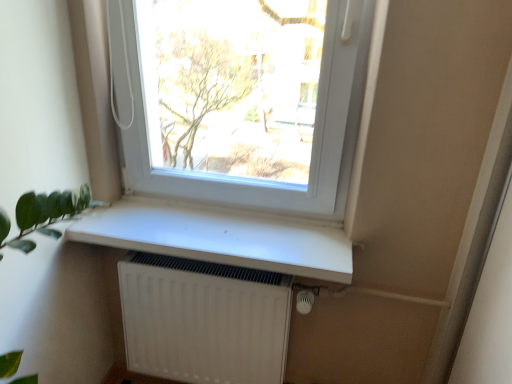
Question: Considering the relative sizes of white plastic window at upper center and white matte window sill at center in the image provided, is white plastic window at upper center bigger than white matte window sill at center?

Choices:
 (A) no
 (B) yes

Answer: (B)

Question: From the image's perspective, is white plastic window at upper center above white matte window sill at center?

Choices:
 (A) no
 (B) yes

Answer: (B)

Question: Can you confirm if white plastic window at upper center is positioned to the left of white matte window sill at center?

Choices:
 (A) no
 (B) yes

Answer: (A)

Question: Is white plastic window at upper center in contact with white matte window sill at center?

Choices:
 (A) no
 (B) yes

Answer: (A)

Question: Can you confirm if white plastic window at upper center is thinner than white matte window sill at center?

Choices:
 (A) no
 (B) yes

Answer: (B)

Question: From a real-world perspective, relative to white plastic window at upper center, is white matte window sill at center vertically above or below?

Choices:
 (A) above
 (B) below

Answer: (B)

Question: Is white matte window sill at center inside or outside of white plastic window at upper center?

Choices:
 (A) outside
 (B) inside

Answer: (A)

Question: Is point pyautogui.click(x=281, y=256) closer or farther from the camera than point pyautogui.click(x=170, y=0)?

Choices:
 (A) closer
 (B) farther

Answer: (A)

Question: In the image, is white matte window sill at center positioned in front of or behind white plastic window at upper center?

Choices:
 (A) behind
 (B) front

Answer: (A)

Question: Is point (130, 296) positioned closer to the camera than point (185, 231)?

Choices:
 (A) farther
 (B) closer

Answer: (A)

Question: In terms of height, does white matte radiator at lower center look taller or shorter compared to white matte window sill at center?

Choices:
 (A) short
 (B) tall

Answer: (B)

Question: Visually, is white matte radiator at lower center positioned to the left or to the right of white matte window sill at center?

Choices:
 (A) right
 (B) left

Answer: (B)

Question: Is white matte radiator at lower center spatially inside white matte window sill at center, or outside of it?

Choices:
 (A) inside
 (B) outside

Answer: (B)

Question: From their relative heights in the image, would you say white plastic window at upper center is taller or shorter than white matte window sill at center?

Choices:
 (A) tall
 (B) short

Answer: (A)

Question: Based on their positions, is white plastic window at upper center located to the left or right of white matte window sill at center?

Choices:
 (A) right
 (B) left

Answer: (A)